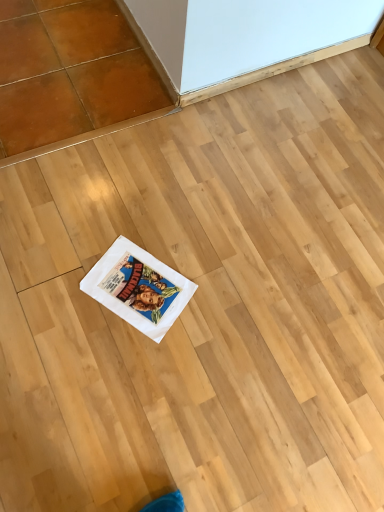
Image resolution: width=384 pixels, height=512 pixels. Describe the element at coordinates (138, 288) in the screenshot. I see `white paper comic book at center` at that location.

Locate an element on the screen. white paper comic book at center is located at coordinates (138, 288).

What is the approximate width of white paper comic book at center?

The width of white paper comic book at center is 12.01 inches.

Measure the distance between white paper comic book at center and camera.

white paper comic book at center and camera are 3.98 feet apart from each other.

Identify the location of white paper comic book at center. The height and width of the screenshot is (512, 384). (138, 288).